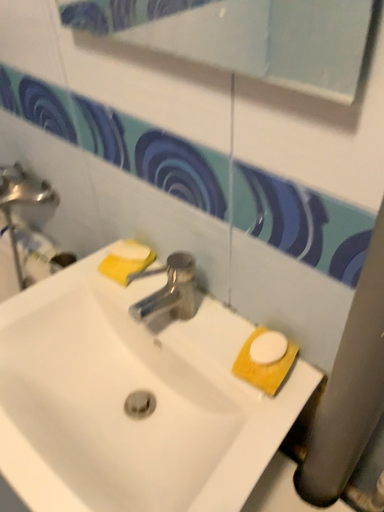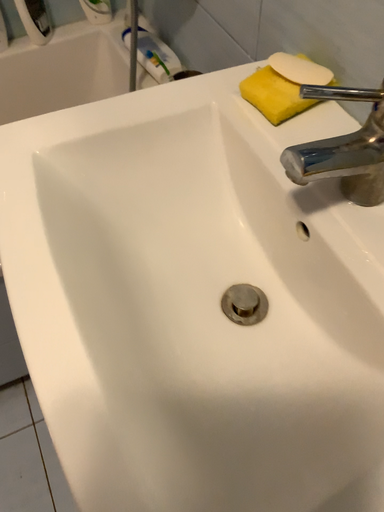
Question: Which way did the camera rotate in the video?

Choices:
 (A) rotated upward
 (B) rotated downward

Answer: (B)